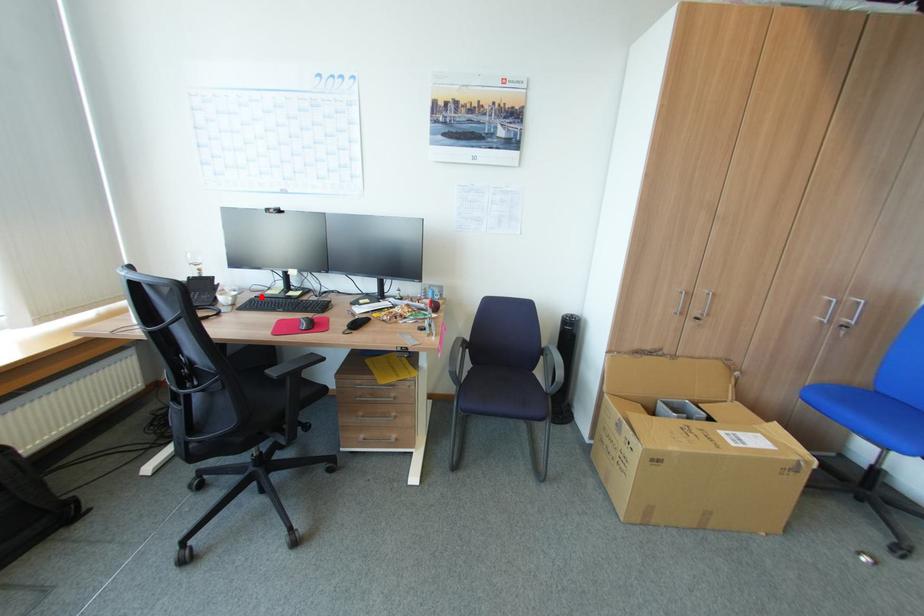
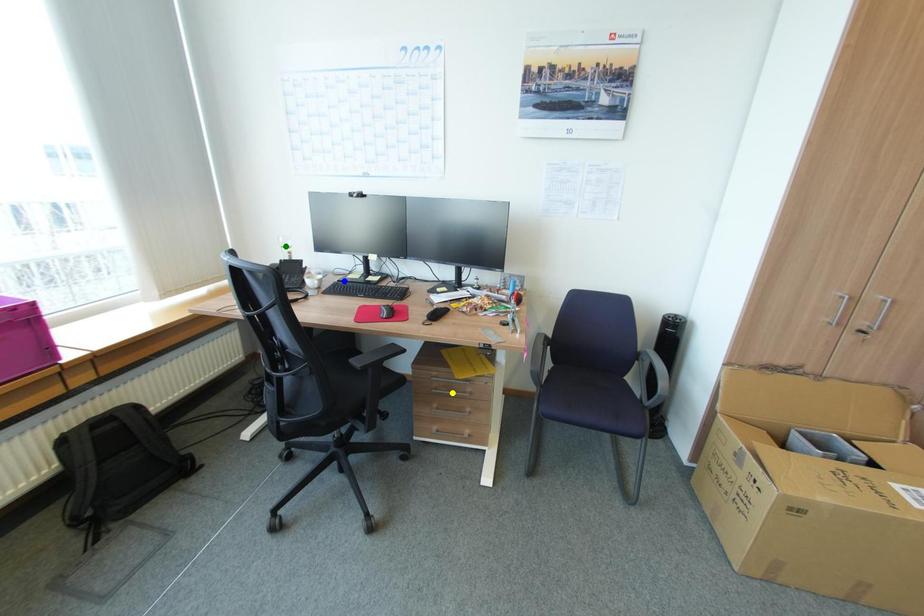
Question: I am providing you with two images of the same scene from different viewpoints. A red point is marked on the first image. You are given multiple points on the second image. Which point in image 2 represents the same 3d spot as the red point in image 1?

Choices:
 (A) blue point
 (B) yellow point
 (C) green point

Answer: (A)